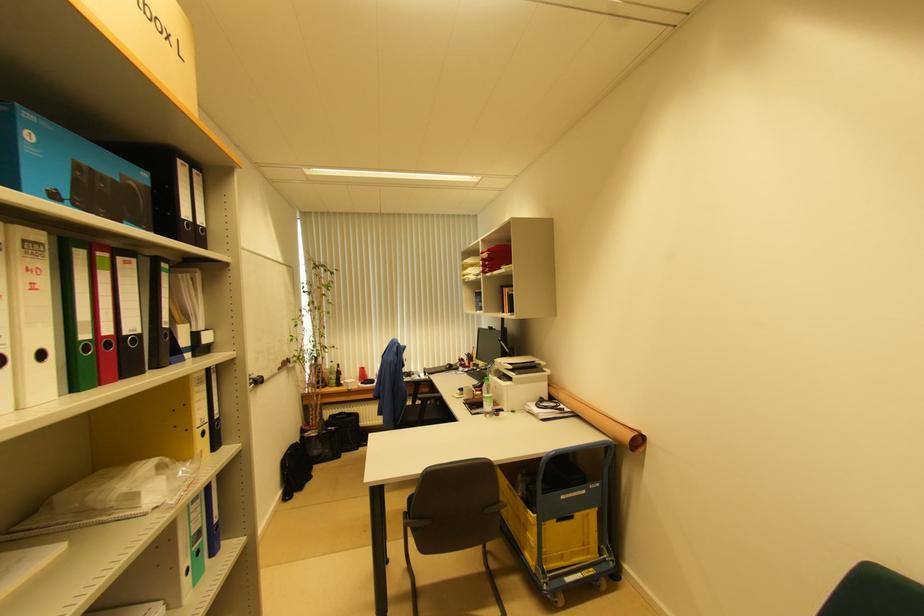
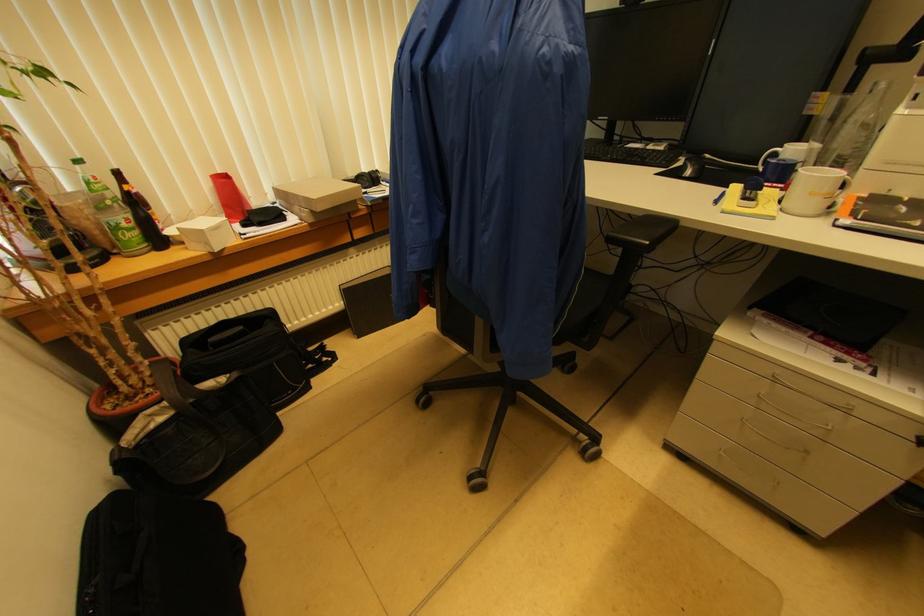
Find the pixel in the second image that matches [339,368] in the first image.

(118, 176)